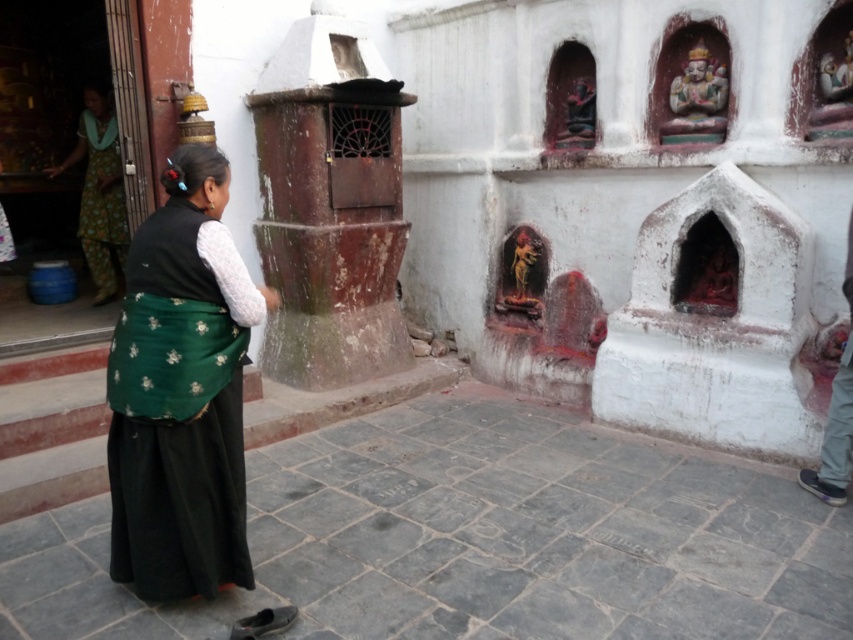
Between green floral fabric at center and green floral fabric at left, which one has less height?

Standing shorter between the two is green floral fabric at center.

Measure the distance from green floral fabric at center to green floral fabric at left.

3.23 meters

The image size is (853, 640). In order to click on green floral fabric at center in this screenshot , I will do `click(180, 396)`.

Locate an element on the screen. green floral fabric at center is located at coordinates coord(180,396).